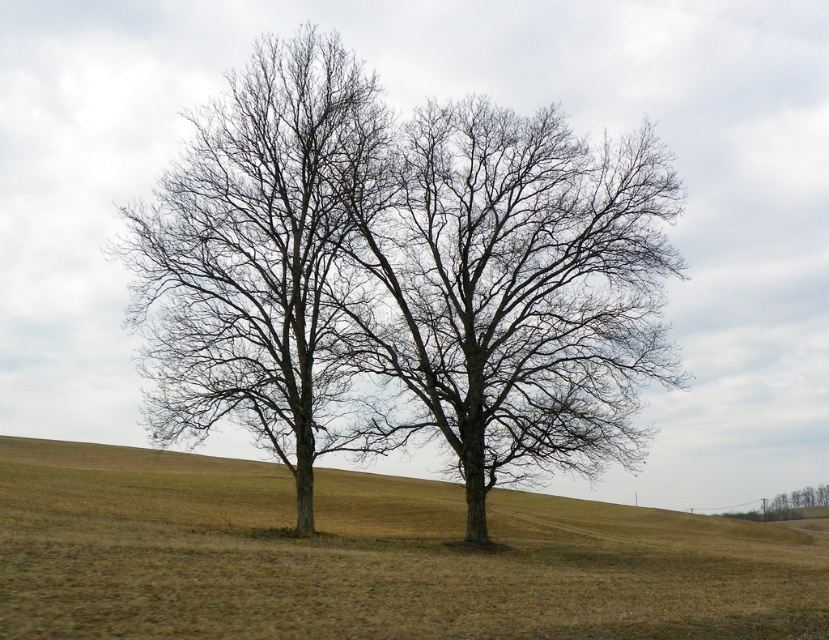
Which is more to the right, brown grassy hillside at center or brown leafless tree at lower right?

Positioned to the right is brown leafless tree at lower right.

Which is behind, point (61, 608) or point (776, 515)?

The point (776, 515) is behind.

Where is `brown grassy hillside at center`? This screenshot has width=829, height=640. brown grassy hillside at center is located at coordinates (369, 557).

This screenshot has height=640, width=829. Describe the element at coordinates (508, 291) in the screenshot. I see `bare wood tree at center` at that location.

In the scene shown: Who is positioned more to the left, bare wood tree at center or bare branches at center?

bare branches at center

Which is in front, point (390, 396) or point (337, 310)?

Point (337, 310) is more forward.

Locate an element on the screen. Image resolution: width=829 pixels, height=640 pixels. bare wood tree at center is located at coordinates (508, 291).

What do you see at coordinates (369, 557) in the screenshot?
I see `brown grassy hillside at center` at bounding box center [369, 557].

Between brown grassy hillside at center and bare branches at center, which one appears on the right side from the viewer's perspective?

brown grassy hillside at center is more to the right.

Does point (86, 532) come in front of point (240, 83)?

Yes, it is in front of point (240, 83).

This screenshot has height=640, width=829. I want to click on brown grassy hillside at center, so [x=369, y=557].